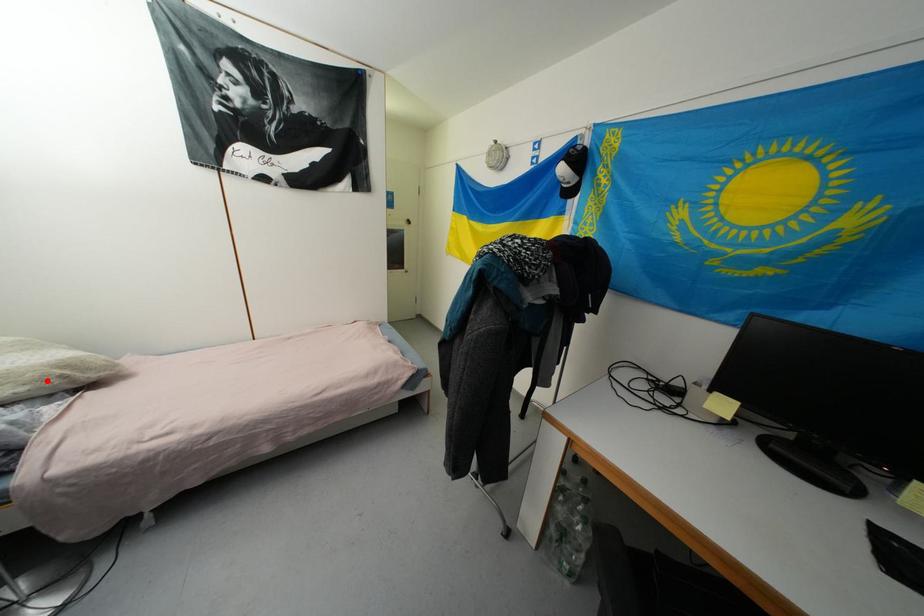
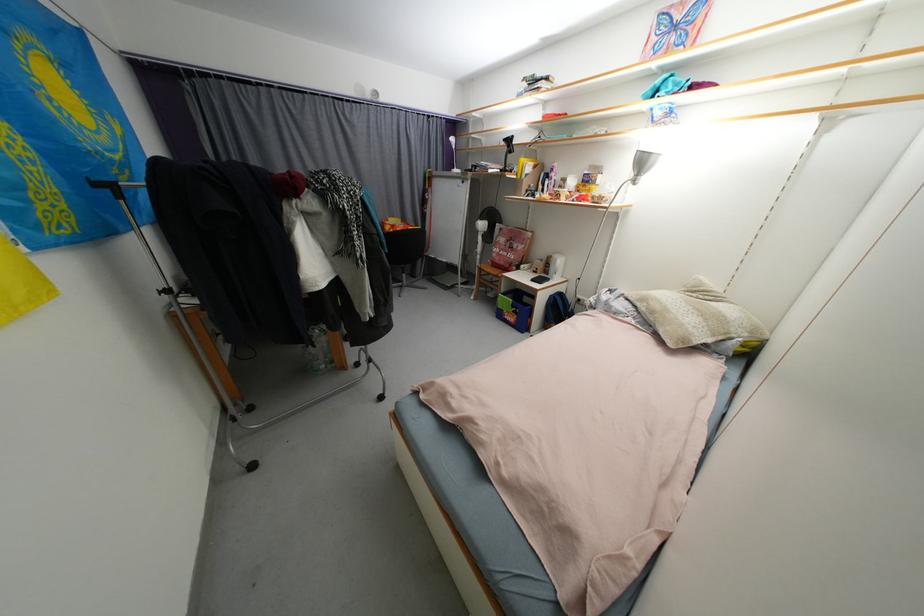
Find the pixel in the second image that matches the highlighted location in the first image.

(658, 314)